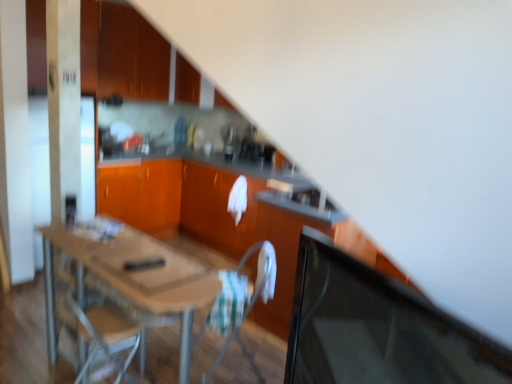
Question: Does matte wood cabinets at upper left, acting as the 1th cabinetry starting from the top, have a greater width compared to wooden table at center?

Choices:
 (A) yes
 (B) no

Answer: (B)

Question: Is matte wood cabinets at upper left, positioned as the 2th cabinetry in bottom-to-top order, located outside wooden table at center?

Choices:
 (A) no
 (B) yes

Answer: (B)

Question: Is matte wood cabinets at upper left, acting as the 1th cabinetry starting from the top, with wooden table at center?

Choices:
 (A) yes
 (B) no

Answer: (B)

Question: Does matte wood cabinets at upper left, positioned as the 2th cabinetry in bottom-to-top order, turn towards wooden table at center?

Choices:
 (A) yes
 (B) no

Answer: (B)

Question: From the image's perspective, is matte wood cabinets at upper left, acting as the 1th cabinetry starting from the top, over wooden table at center?

Choices:
 (A) yes
 (B) no

Answer: (A)

Question: Is wooden table at center completely or partially inside matte wood cabinets at upper left, positioned as the 2th cabinetry in bottom-to-top order?

Choices:
 (A) no
 (B) yes

Answer: (A)

Question: Is black glossy computer monitor at right closer to camera compared to wooden table at center?

Choices:
 (A) yes
 (B) no

Answer: (A)

Question: Considering the relative sizes of black glossy computer monitor at right and wooden table at center in the image provided, is black glossy computer monitor at right thinner than wooden table at center?

Choices:
 (A) no
 (B) yes

Answer: (B)

Question: Is wooden table at center inside black glossy computer monitor at right?

Choices:
 (A) no
 (B) yes

Answer: (A)

Question: From the image's perspective, is black glossy computer monitor at right on top of wooden table at center?

Choices:
 (A) no
 (B) yes

Answer: (B)

Question: Can you confirm if black glossy computer monitor at right is wider than wooden table at center?

Choices:
 (A) no
 (B) yes

Answer: (A)

Question: Considering the relative positions of black glossy computer monitor at right and wooden table at center in the image provided, is black glossy computer monitor at right behind wooden table at center?

Choices:
 (A) yes
 (B) no

Answer: (B)

Question: Can you confirm if wooden table at center is thinner than black glossy computer monitor at right?

Choices:
 (A) no
 (B) yes

Answer: (A)